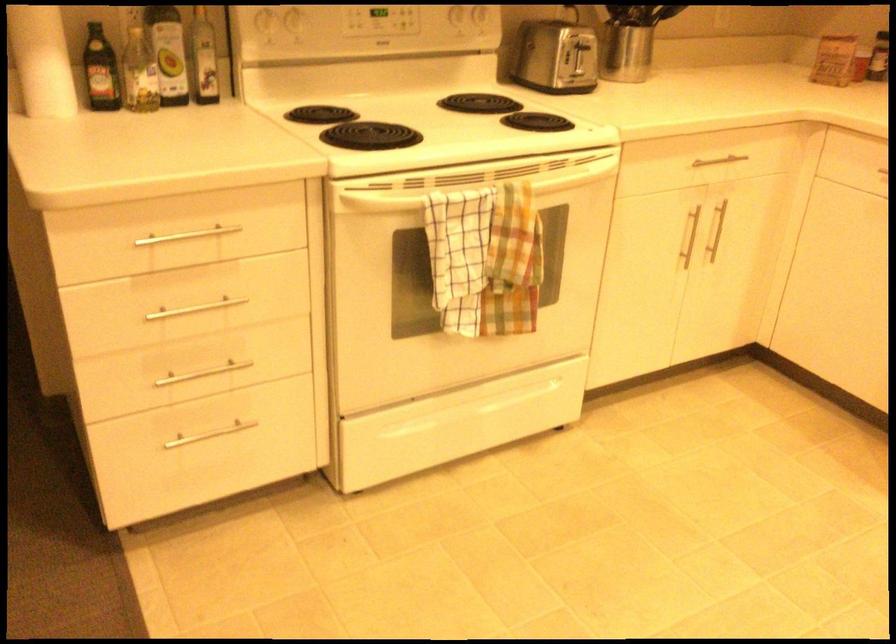
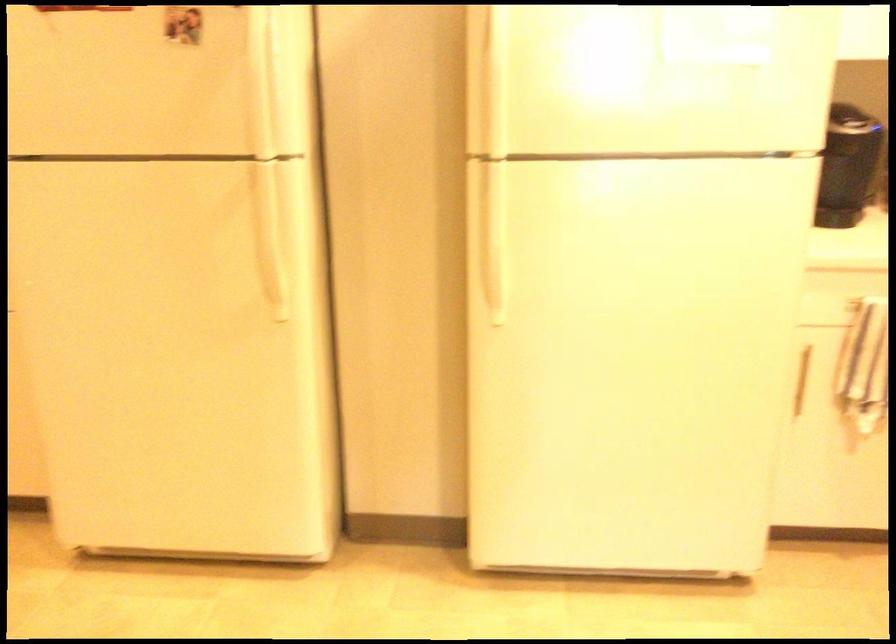
Question: The camera is either moving clockwise (left) or counter-clockwise (right) around the object. The first image is from the beginning of the video and the second image is from the end. Is the camera moving left or right when shooting the video?

Choices:
 (A) Left
 (B) Right

Answer: (A)